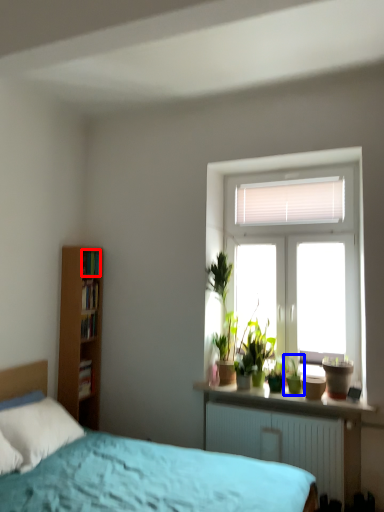
Question: Among these objects, which one is nearest to the camera, book (highlighted by a red box) or houseplant (highlighted by a blue box)?

Choices:
 (A) book
 (B) houseplant

Answer: (B)